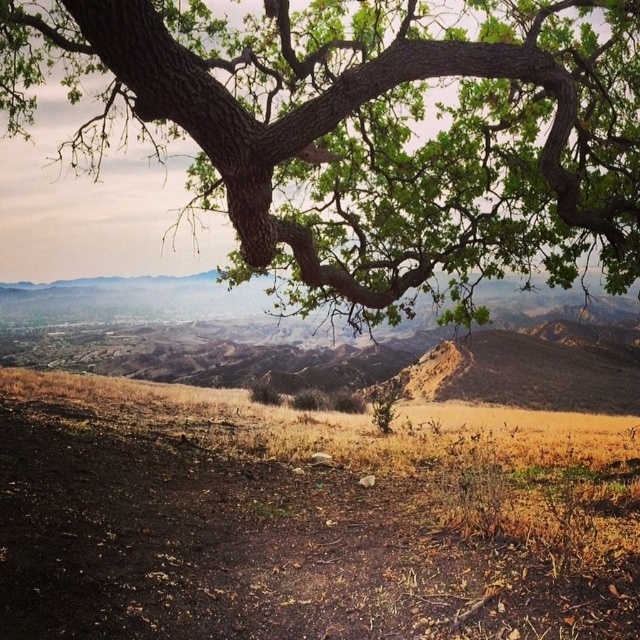
Is green rough bark tree at upper center shorter than brown dry soil at lower center?

In fact, green rough bark tree at upper center may be taller than brown dry soil at lower center.

Is green rough bark tree at upper center positioned before brown dry soil at lower center?

No, green rough bark tree at upper center is further to the viewer.

This screenshot has width=640, height=640. Describe the element at coordinates (365, 134) in the screenshot. I see `green rough bark tree at upper center` at that location.

This screenshot has width=640, height=640. I want to click on green rough bark tree at upper center, so click(365, 134).